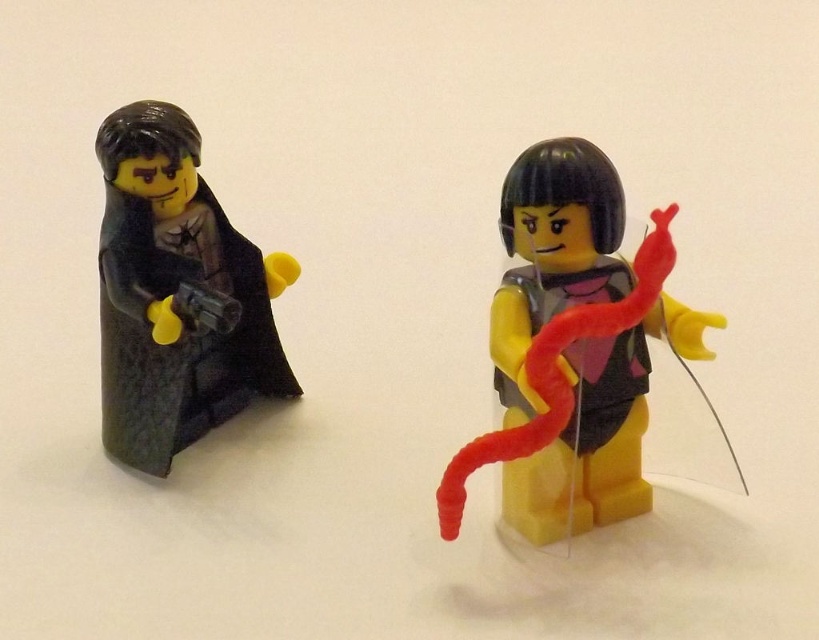
You are a game developer designing a virtual LEGO world. You need to place a new treasure chest at coordinates where the matte black minifigure at center is located. What are the coordinates you should use?

The coordinates for the matte black minifigure at center are at point (x=572, y=348), so you should place the treasure chest at coordinates (x=572, y=348).

You are a collector who wants to display the matte black minifigure at center and the matte black cape at left on a shelf. If the shelf has a height limit of 10 cm, and the cape is 12 cm tall, will both items fit vertically?

The matte black cape at left is 12 cm tall, exceeding the shelf height limit of 10 cm. Therefore, the matte black cape at left cannot fit vertically on the shelf, while the smaller matte black minifigure at center might fit if its height is under 10 cm.

You are a photographer standing in front of the matte black minifigure at center. You want to take a closeup photo of it. If your camera requires you to be at least 30 inches away to focus properly, will you need to move closer or farther away?

The matte black minifigure at center and viewer are 36.76 inches apart from each other. Since 36.76 inches is more than 30 inches, you are already far enough away to focus properly. You do not need to move closer or farther away.